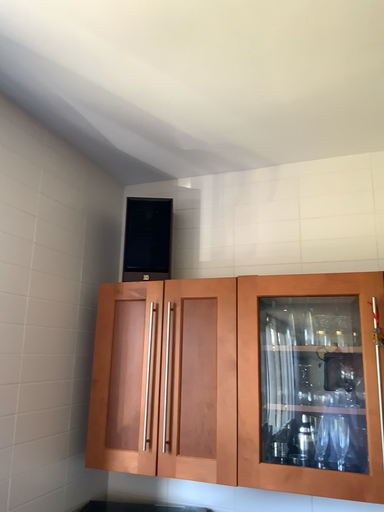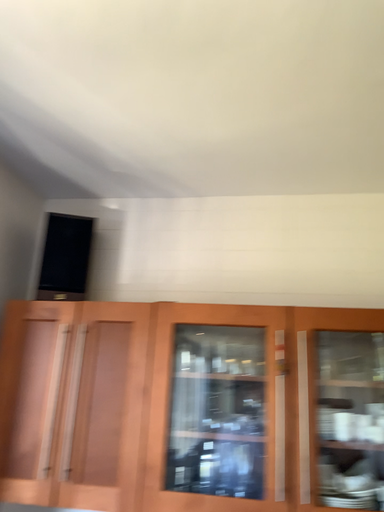
Question: Which way did the camera rotate in the video?

Choices:
 (A) rotated right
 (B) rotated left

Answer: (A)